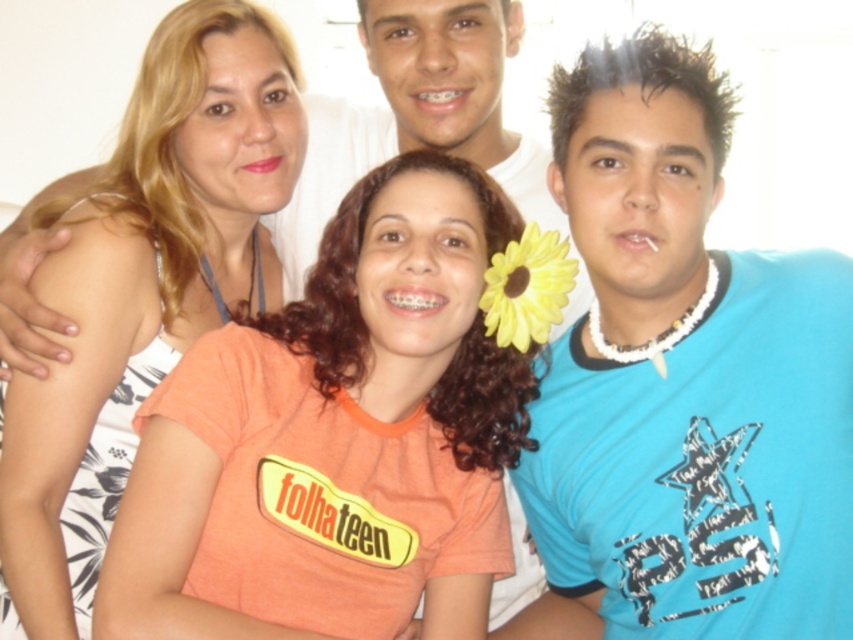
Who is positioned more to the right, blue printed t-shirt at center or orange cotton t-shirt at center?

From the viewer's perspective, blue printed t-shirt at center appears more on the right side.

Between point (604, 340) and point (257, 444), which one is positioned in front?

Positioned in front is point (257, 444).

At what (x,y) coordinates should I click in order to perform the action: click on blue printed t-shirt at center. Please return your answer as a coordinate pair (x, y). Image resolution: width=853 pixels, height=640 pixels. Looking at the image, I should click on (683, 381).

Who is more distant from viewer, (111, 205) or (502, 316)?

The point (111, 205) is behind.

Which is more to the left, matte orange t-shirt at center or yellow fabric flower at center?

Positioned to the left is matte orange t-shirt at center.

What do you see at coordinates (144, 276) in the screenshot? I see `matte orange t-shirt at center` at bounding box center [144, 276].

This screenshot has height=640, width=853. I want to click on matte orange t-shirt at center, so click(144, 276).

In the scene shown: Can you confirm if orange cotton t-shirt at center is positioned above matte orange t-shirt at center?

Incorrect, orange cotton t-shirt at center is not positioned above matte orange t-shirt at center.

Is orange cotton t-shirt at center smaller than matte orange t-shirt at center?

Yes, orange cotton t-shirt at center is smaller than matte orange t-shirt at center.

Where is `orange cotton t-shirt at center`? The height and width of the screenshot is (640, 853). orange cotton t-shirt at center is located at coordinates (335, 438).